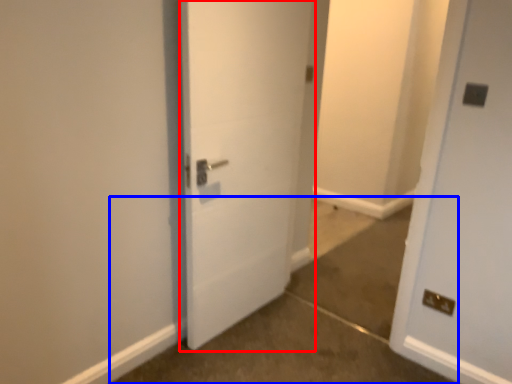
Question: Which of the following is the closest to the observer, door (highlighted by a red box) or concrete (highlighted by a blue box)?

Choices:
 (A) door
 (B) concrete

Answer: (B)